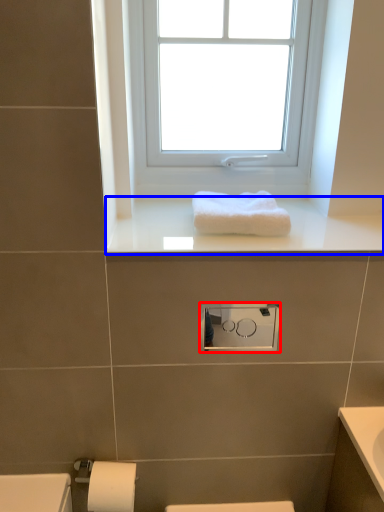
Question: Among these objects, which one is farthest to the camera, medicine cabinet (highlighted by a red box) or window sill (highlighted by a blue box)?

Choices:
 (A) medicine cabinet
 (B) window sill

Answer: (A)